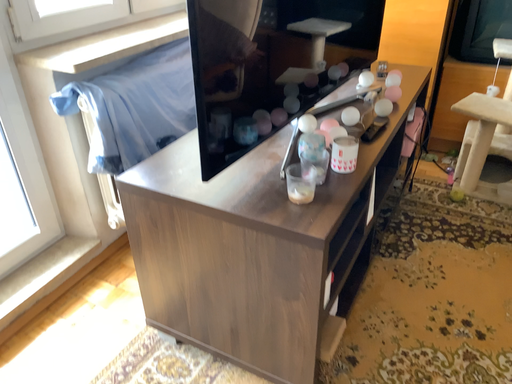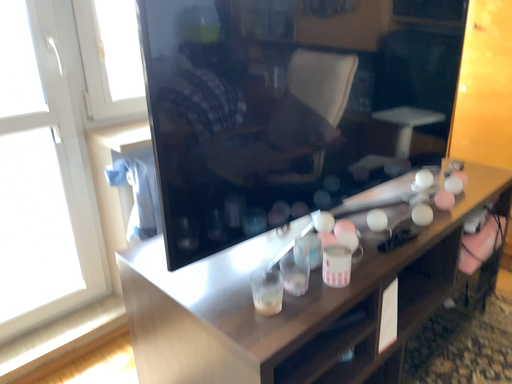
Question: How did the camera likely rotate when shooting the video?

Choices:
 (A) rotated right
 (B) rotated left

Answer: (B)